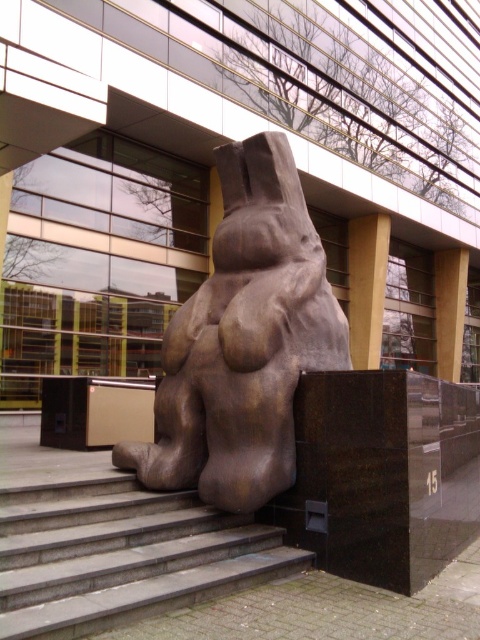
Who is taller, bronze sculpture at center or smooth concrete stairs at center?

bronze sculpture at center

Is bronze sculpture at center wider than smooth concrete stairs at center?

No, bronze sculpture at center is not wider than smooth concrete stairs at center.

This screenshot has height=640, width=480. Identify the location of bronze sculpture at center. (243, 340).